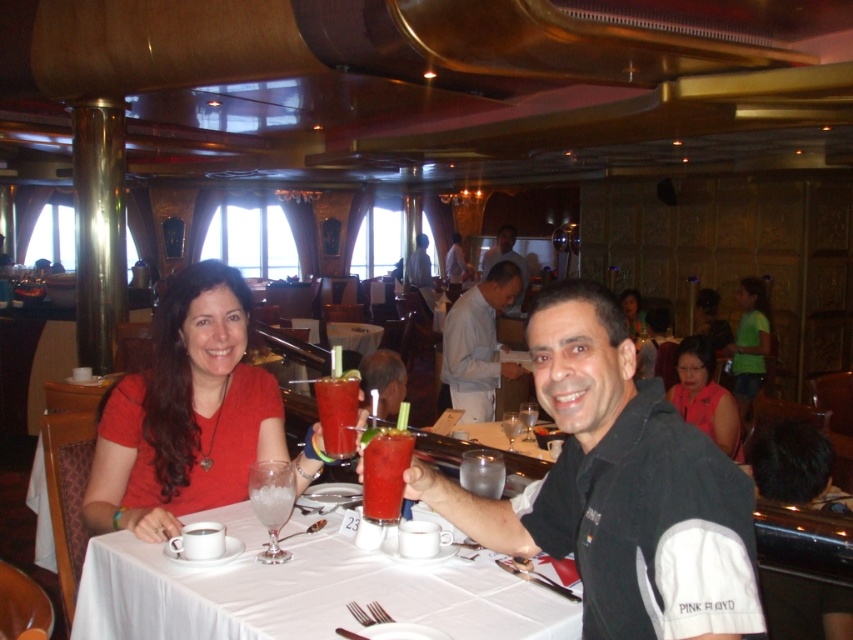
You are a waiter in the cruise ship dining area. You need to deliver a dessert to the table where the black matte shirt at center and the smooth glass drink at center are located. Which item should you avoid placing the dessert on top of to prevent it from slipping?

You should avoid placing the dessert on top of the smooth glass drink at center because the black matte shirt at center is positioned over it, meaning the shirt is above the drink. Placing the dessert on the drink might cause it to slip off the shirt.

You are a waiter in the cruise ship dining area. You need to place a new drink order for the guests seated at the white glossy table at center. However, there is also a light blue shirt at center. Which object should you prioritize placing the drink on?

You should prioritize placing the drink on the white glossy table at center because the light blue shirt at center is larger in size and might not be suitable for placing drinks.

You are a waiter in the cruise ship dining area. You need to place a new drink order for the guests seated at the white glossy table at center. Where should you place the drink relative to the matte black hair at center?

The white glossy table at center is located below matte black hair at center, so you should place the drink on the white glossy table at center which is positioned below the matte black hair at center.